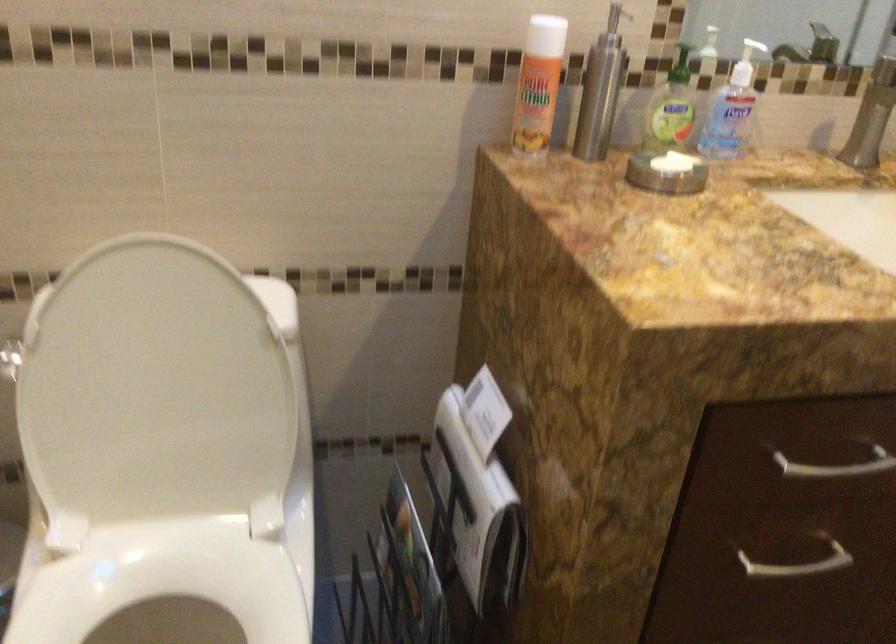
At what (x,y) coordinates should I click in order to perform the action: click on white toilet lid. Please return your answer as a coordinate pair (x, y). The image size is (896, 644). Looking at the image, I should click on (152, 391).